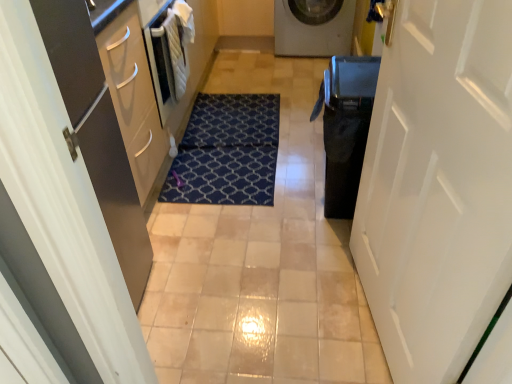
The width and height of the screenshot is (512, 384). In order to click on free area in between white matte door at right, the first door from the right, and blue patterned mat at center in this screenshot , I will do `click(279, 236)`.